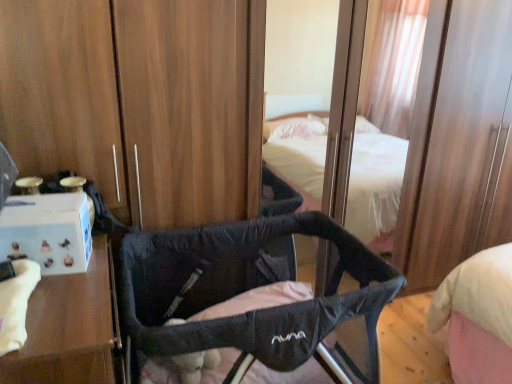
Question: Is black fabric infant bed at center far from white cardboard box at left?

Choices:
 (A) no
 (B) yes

Answer: (A)

Question: Is black fabric infant bed at center bigger than white cardboard box at left?

Choices:
 (A) no
 (B) yes

Answer: (B)

Question: Is black fabric infant bed at center smaller than white cardboard box at left?

Choices:
 (A) yes
 (B) no

Answer: (B)

Question: Is black fabric infant bed at center beside white cardboard box at left?

Choices:
 (A) no
 (B) yes

Answer: (A)

Question: Is black fabric infant bed at center completely or partially outside of white cardboard box at left?

Choices:
 (A) no
 (B) yes

Answer: (B)

Question: From the image's perspective, is black fabric infant bed at center above white cardboard box at left?

Choices:
 (A) no
 (B) yes

Answer: (B)

Question: From the image's perspective, is white cardboard box at left above black fabric infant bed at center?

Choices:
 (A) yes
 (B) no

Answer: (B)

Question: Can you confirm if white cardboard box at left is wider than black fabric infant bed at center?

Choices:
 (A) no
 (B) yes

Answer: (A)

Question: From a real-world perspective, is white cardboard box at left over black fabric infant bed at center?

Choices:
 (A) no
 (B) yes

Answer: (B)

Question: Is white cardboard box at left smaller than black fabric infant bed at center?

Choices:
 (A) yes
 (B) no

Answer: (A)

Question: From the image's perspective, is white cardboard box at left under black fabric infant bed at center?

Choices:
 (A) yes
 (B) no

Answer: (A)

Question: From a real-world perspective, does white cardboard box at left sit lower than black fabric infant bed at center?

Choices:
 (A) yes
 (B) no

Answer: (B)

Question: Relative to black fabric infant bed at center, is white cardboard box at left in front or behind?

Choices:
 (A) behind
 (B) front

Answer: (B)